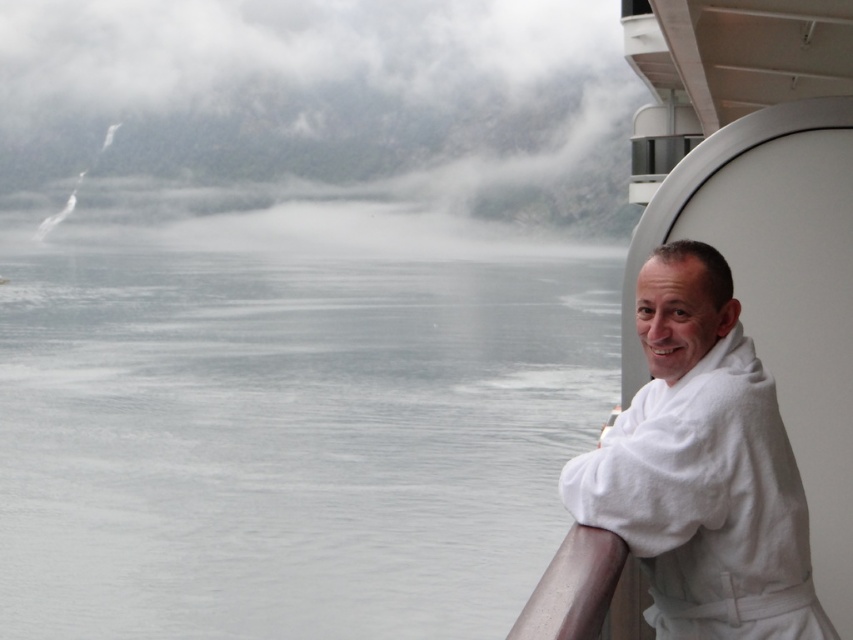
You are standing on the cruise ship deck and want to walk from the gray water at left to the white bathrobe at right. Which object will you encounter first?

You will encounter the gray water at left first because it is closer to you than the white bathrobe at right, which is further away.

In the scene shown: You are a passenger on the cruise ship and want to take a photo of the gray water at left. Where exactly should you stand to capture it in your camera viewfinder?

The gray water at left is located at coordinates point (289,429), so you should position yourself to aim your camera at that specific point to capture it in the viewfinder.

You are standing on the cruise ship deck and want to take a photo of two points marked in the scene. The first point is at coordinate point [392,188] and the second is at point [598,548]. Which point should you focus on first if you want to capture both in a single shot without moving the camera?

You should focus on point [392,188] first because it is closer to you than point [598,548], allowing both points to be in focus within the camera depth of field.